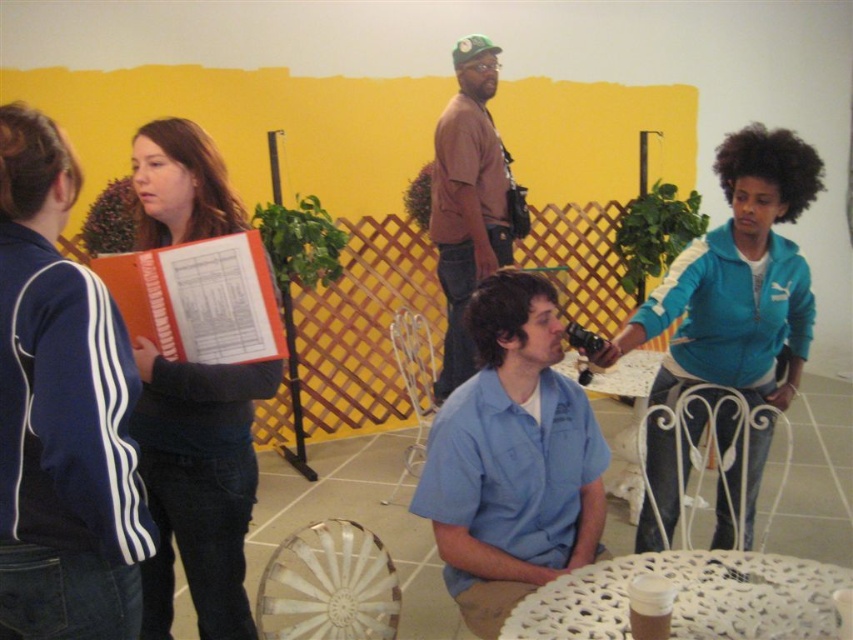
Does brown cotton shirt at center have a greater width compared to white plastic chair at lower center?

No, brown cotton shirt at center is not wider than white plastic chair at lower center.

Find the location of a particular element. brown cotton shirt at center is located at coordinates (469, 200).

The width and height of the screenshot is (853, 640). What do you see at coordinates (469, 200) in the screenshot?
I see `brown cotton shirt at center` at bounding box center [469, 200].

Find the location of a particular element. Image resolution: width=853 pixels, height=640 pixels. brown cotton shirt at center is located at coordinates (469, 200).

Can you confirm if matte orange folder at upper left is smaller than white plastic chair at lower center?

Indeed, matte orange folder at upper left has a smaller size compared to white plastic chair at lower center.

Does matte orange folder at upper left appear on the left side of white plastic chair at lower center?

Yes, matte orange folder at upper left is to the left of white plastic chair at lower center.

Is point (218, 554) positioned behind point (287, 586)?

No.

Where is `matte orange folder at upper left`? Image resolution: width=853 pixels, height=640 pixels. matte orange folder at upper left is located at coordinates (198, 484).

Who is taller, blue fleece jacket at right or matte orange folder at upper left?

blue fleece jacket at right is taller.

Between point (749, 180) and point (202, 401), which one is positioned behind?

Point (749, 180)

Does point (752, 241) come behind point (155, 564)?

Yes, it is.

Identify the location of blue fleece jacket at right. The width and height of the screenshot is (853, 640). (738, 280).